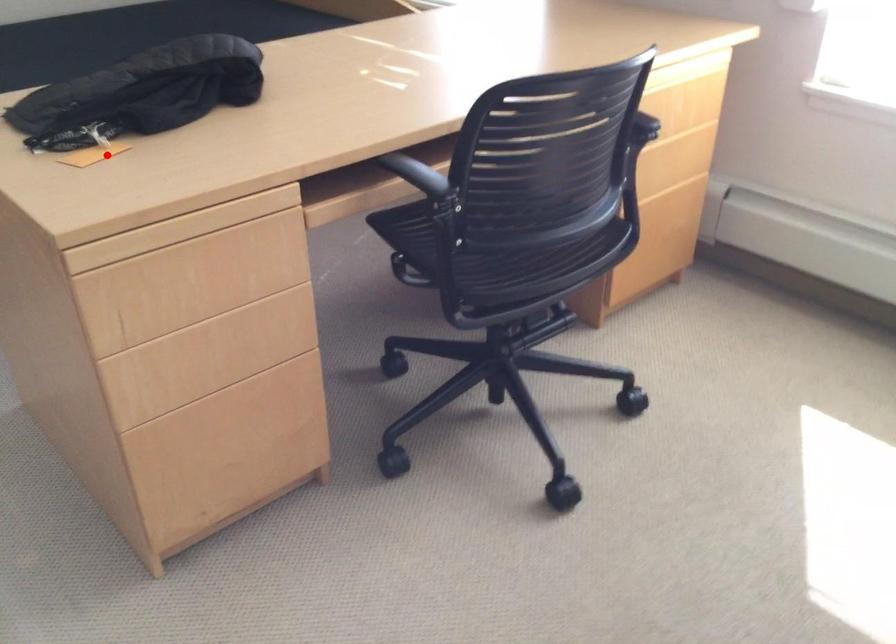
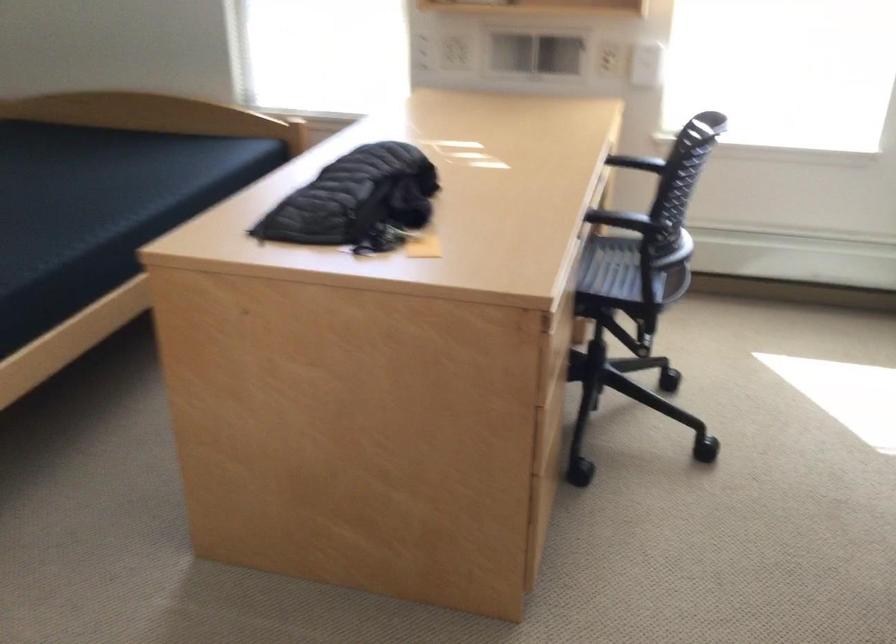
Where in the second image is the point corresponding to the highlighted location from the first image?

(421, 245)